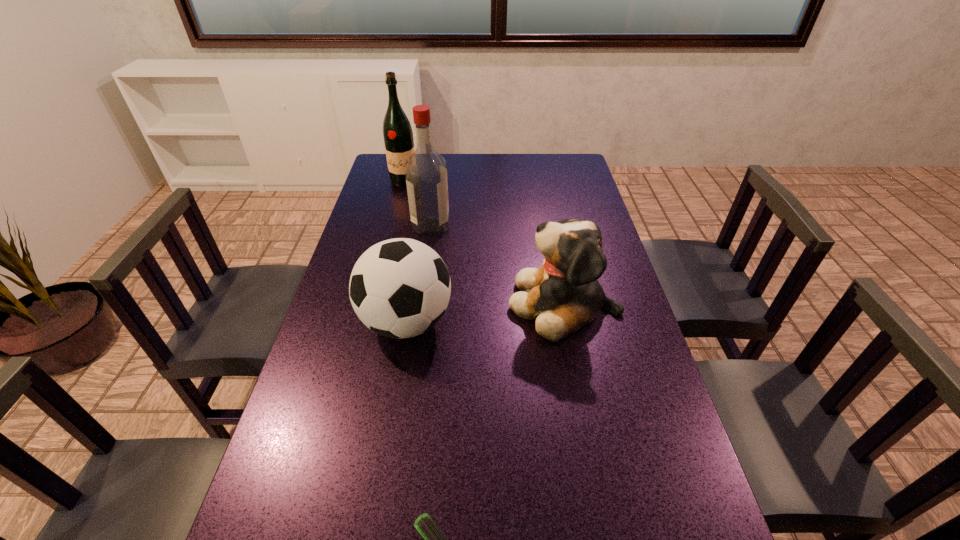
In order to click on the farther liquor in this screenshot , I will do `click(397, 132)`.

Find the location of a particular element. The image size is (960, 540). the farthest object is located at coordinates (397, 132).

Locate an element on the screen. the right liquor is located at coordinates (426, 174).

Find the location of `the nearer liquor`. the nearer liquor is located at coordinates (426, 174).

Find the location of a particular element. This screenshot has width=960, height=540. puppy is located at coordinates point(563,295).

You are a GUI agent. You are given a task and a screenshot of the screen. Output one action in this format:
    pyautogui.click(x=<x>, y=<y>)
    Task: Click on the soccer ball
    The image size is (960, 540).
    Given the screenshot: What is the action you would take?
    pyautogui.click(x=399, y=288)

What are the coordinates of `free space located on the front-facing side of the farthest object` in the screenshot? It's located at (390, 235).

At what (x,y) coordinates should I click in order to perform the action: click on free region located on the front-facing side of the second farthest object. Please return your answer as a coordinate pair (x, y). The height and width of the screenshot is (540, 960). Looking at the image, I should click on (515, 225).

This screenshot has height=540, width=960. What are the coordinates of `free space located 0.300m at the face of the puppy` in the screenshot? It's located at (403, 303).

The image size is (960, 540). Identify the location of vacant space located 0.400m at the face of the puppy. (368, 303).